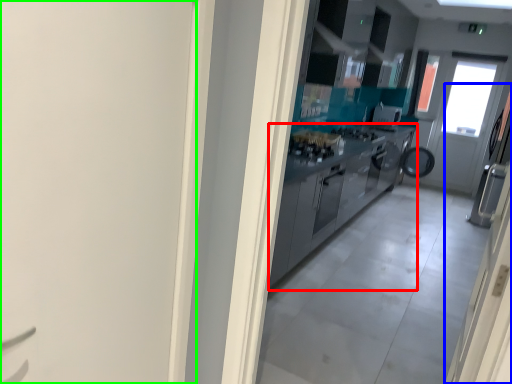
Question: Which is nearer to the cabinetry (highlighted by a red box)? door (highlighted by a blue box) or door (highlighted by a green box).

Choices:
 (A) door
 (B) door

Answer: (B)